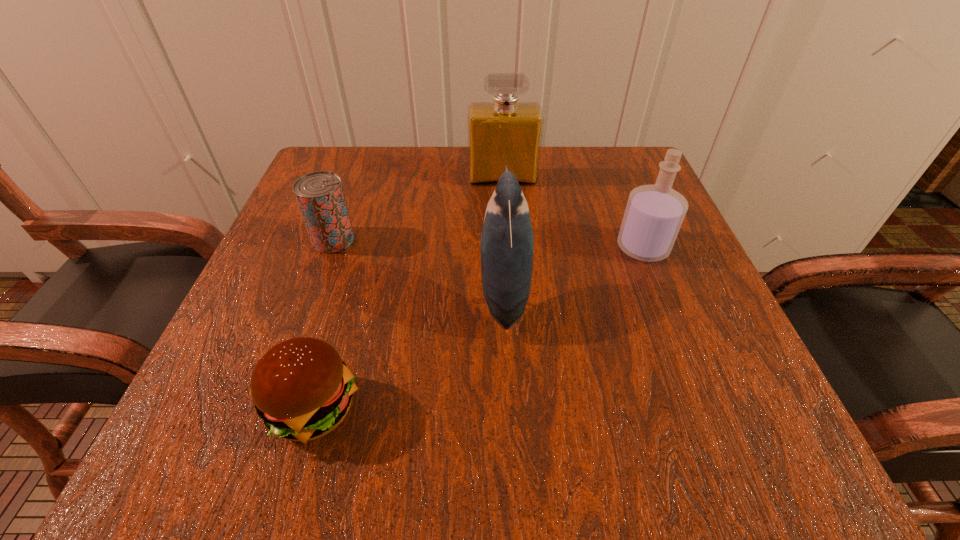
In the image, there is a desktop. At what (x,y) coordinates should I click in order to perform the action: click on free space at the far edge. Please return your answer as a coordinate pair (x, y). Image resolution: width=960 pixels, height=540 pixels. Looking at the image, I should click on (480, 191).

The width and height of the screenshot is (960, 540). I want to click on vacant space at the near edge, so click(x=493, y=411).

The width and height of the screenshot is (960, 540). In the image, there is a desktop. Identify the location of vacant space at the left edge. (257, 339).

Find the location of a particular element. This screenshot has height=540, width=960. free region at the right edge is located at coordinates (682, 283).

Where is `free space at the far left corner`? The height and width of the screenshot is (540, 960). free space at the far left corner is located at coordinates (350, 206).

In the image, there is a desktop. Identify the location of vacant space at the near left corner. click(224, 441).

Identify the location of free space between the left perfume and the beer can. (418, 209).

Find the location of `free area in between the left perfume and the beer can`. free area in between the left perfume and the beer can is located at coordinates (418, 209).

Locate an element on the screen. The image size is (960, 540). vacant region between the farthest object and the nearest object is located at coordinates (408, 294).

Locate an element on the screen. The width and height of the screenshot is (960, 540). vacant region between the rightmost object and the nearest object is located at coordinates (478, 328).